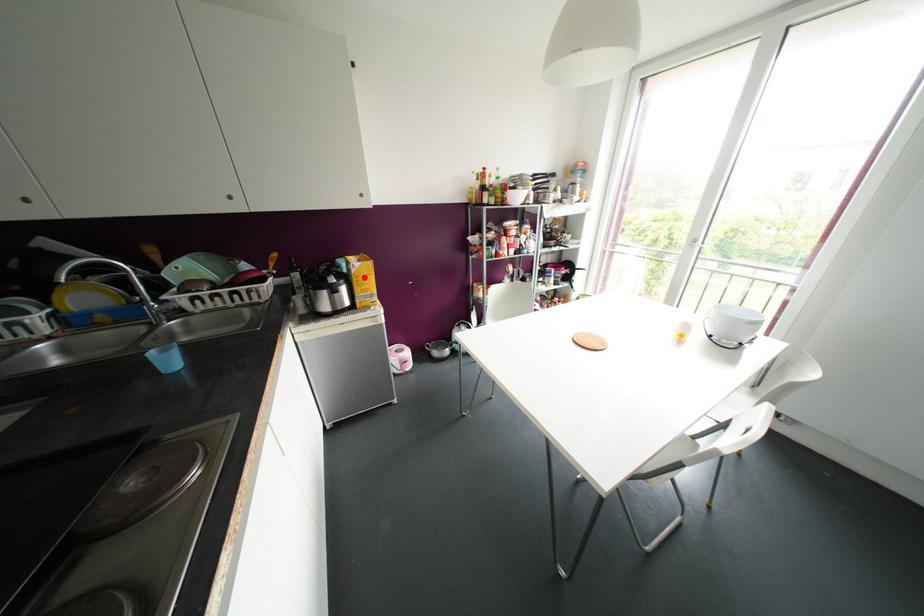
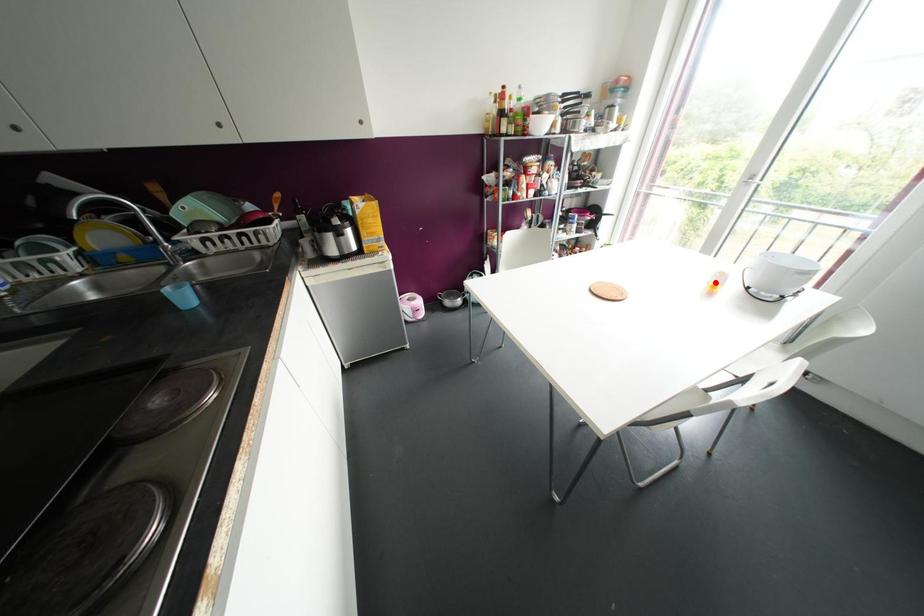
I am providing you with two images of the same scene from different viewpoints. A red point is marked on the first image and another point is marked on the second image. Do the highlighted points in image1 and image2 indicate the same real-world spot?

No